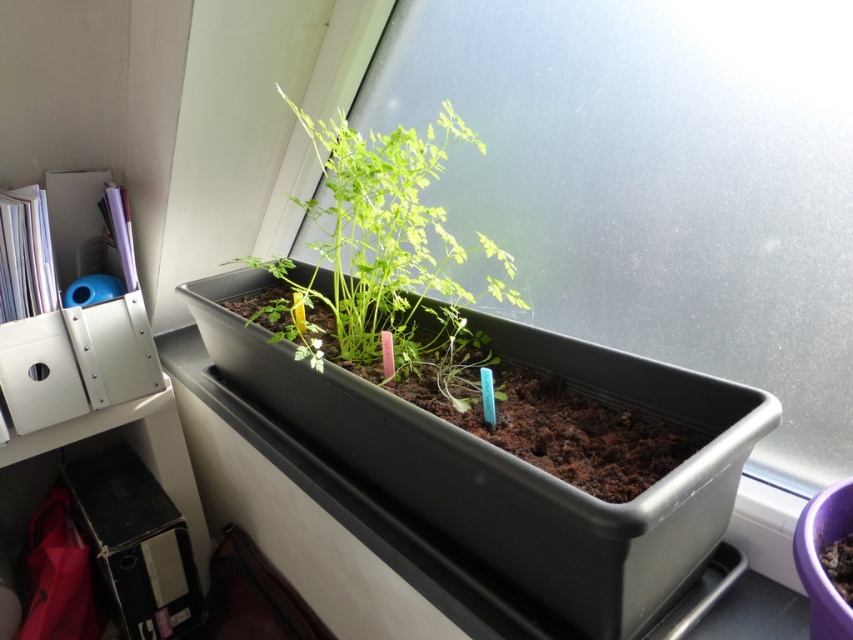
Does black plastic tray at center have a lesser height compared to green matte plant at center?

Incorrect, black plastic tray at center's height does not fall short of green matte plant at center's.

Is point (413, 481) in front of point (360, 227)?

Yes.

I want to click on black plastic tray at center, so click(473, 481).